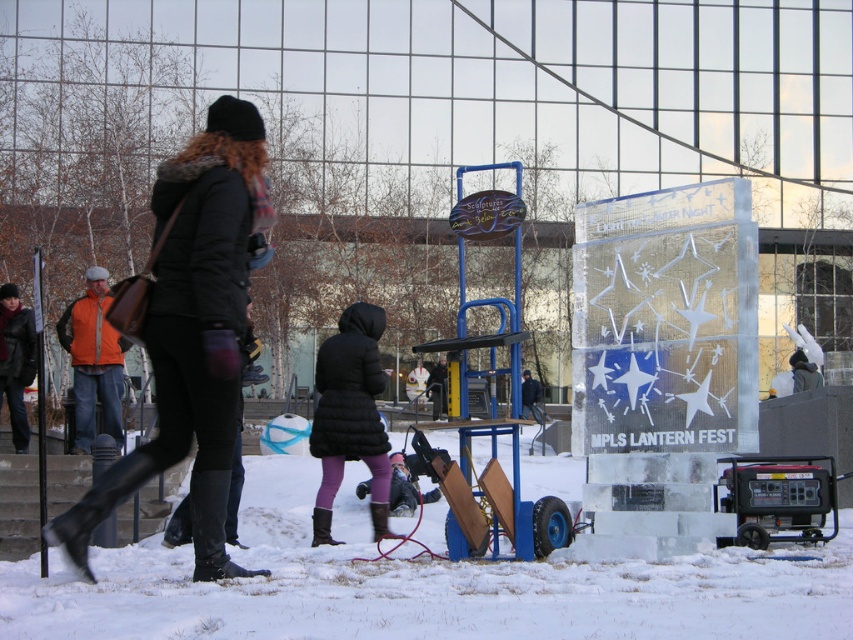
You are standing at the center of the winter scene and want to find the orange fleece vest at left. According to the coordinates provided, in which direction should you look to locate it?

The orange fleece vest at left is located at point coordinates, so you should look to the left side of the scene to find it.

You are organizing a winter festival and need to arrange seating for attendees. The orange fleece vest at left and the dark blue jacket at center are two volunteers. Which volunteer should you assign to a smaller chair based on their size?

The orange fleece vest at left should be assigned to the smaller chair because they occupy less space compared to the dark blue jacket at center.